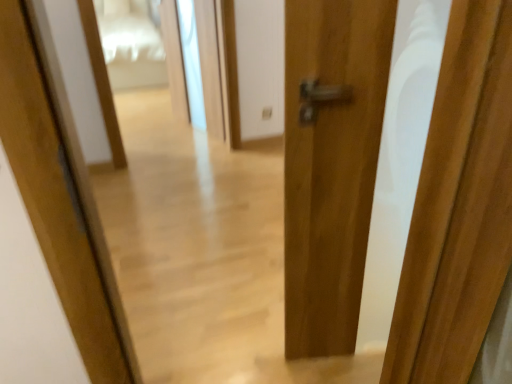
Question: Would you say transparent glass screen door at center is inside or outside matte wood door at center?

Choices:
 (A) outside
 (B) inside

Answer: (A)

Question: Is point (223, 54) positioned closer to the camera than point (345, 306)?

Choices:
 (A) closer
 (B) farther

Answer: (B)

Question: Looking at their shapes, would you say transparent glass screen door at center is wider or thinner than matte wood door at center?

Choices:
 (A) thin
 (B) wide

Answer: (A)

Question: Which is correct: matte wood door at center is inside transparent glass screen door at center, or outside of it?

Choices:
 (A) outside
 (B) inside

Answer: (A)

Question: From a real-world perspective, is matte wood door at center physically located above or below transparent glass screen door at center?

Choices:
 (A) above
 (B) below

Answer: (A)

Question: In terms of height, does matte wood door at center look taller or shorter compared to transparent glass screen door at center?

Choices:
 (A) short
 (B) tall

Answer: (B)

Question: Is matte wood door at center in front of or behind transparent glass screen door at center in the image?

Choices:
 (A) behind
 (B) front

Answer: (B)